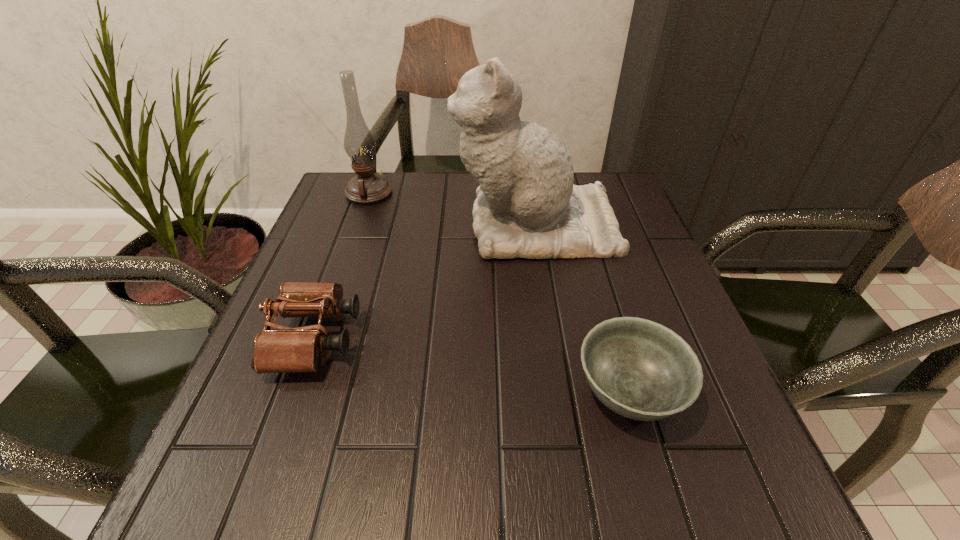
Identify the location of cat that is at the far edge. (527, 206).

Locate an element on the screen. The width and height of the screenshot is (960, 540). oil lamp present at the far edge is located at coordinates (367, 187).

Locate an element on the screen. oil lamp located at the left edge is located at coordinates (367, 187).

Where is `binoculars that is at the left edge`? The image size is (960, 540). binoculars that is at the left edge is located at coordinates (284, 349).

The width and height of the screenshot is (960, 540). In order to click on cat at the right edge in this screenshot , I will do pyautogui.click(x=527, y=206).

Find the location of `bowl located at the right edge`. bowl located at the right edge is located at coordinates (642, 370).

This screenshot has width=960, height=540. What are the coordinates of `object that is at the far left corner` in the screenshot? It's located at (367, 187).

This screenshot has height=540, width=960. I want to click on object located in the far right corner section of the desktop, so click(527, 206).

The height and width of the screenshot is (540, 960). What are the coordinates of `free region at the far edge of the desktop` in the screenshot? It's located at (435, 181).

Locate an element on the screen. The height and width of the screenshot is (540, 960). free space at the near edge of the desktop is located at coordinates (619, 472).